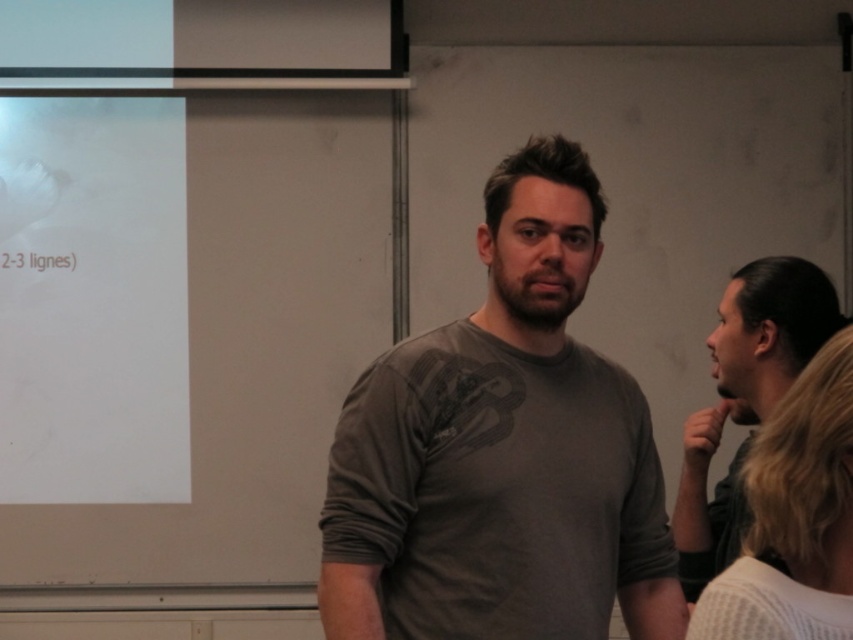
You are an observer in the room. You see the white paper at upper left and the white knitted sweater at right. Which object is taller?

The white paper at upper left is taller than the white knitted sweater at right.